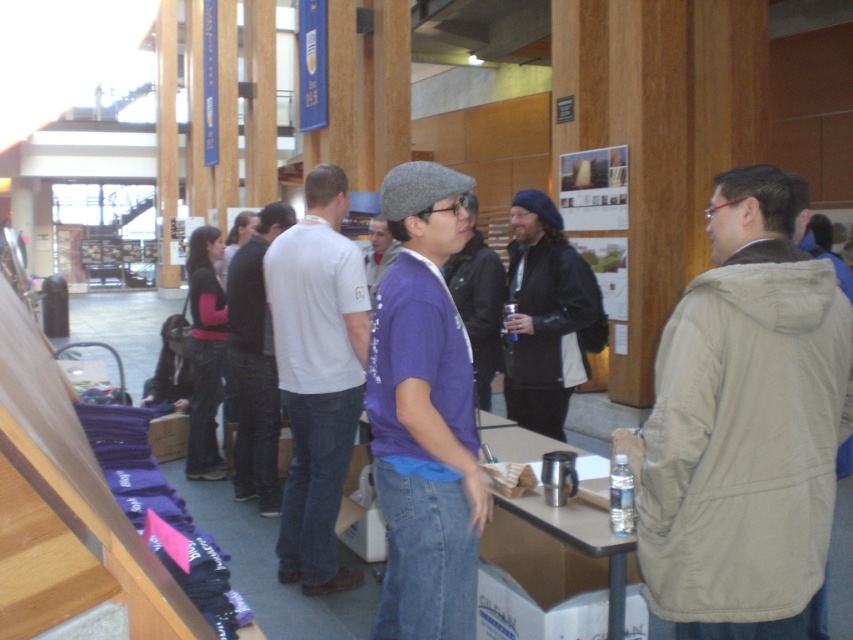
Looking at this image, you are at an event and want to approach the person wearing the black cotton shirt at center. However, there is someone in front of them. Can you see the purple matte shirt at center behind them?

The black cotton shirt at center is in front of the purple matte shirt at center, so yes, you can see the purple matte shirt at center behind them.